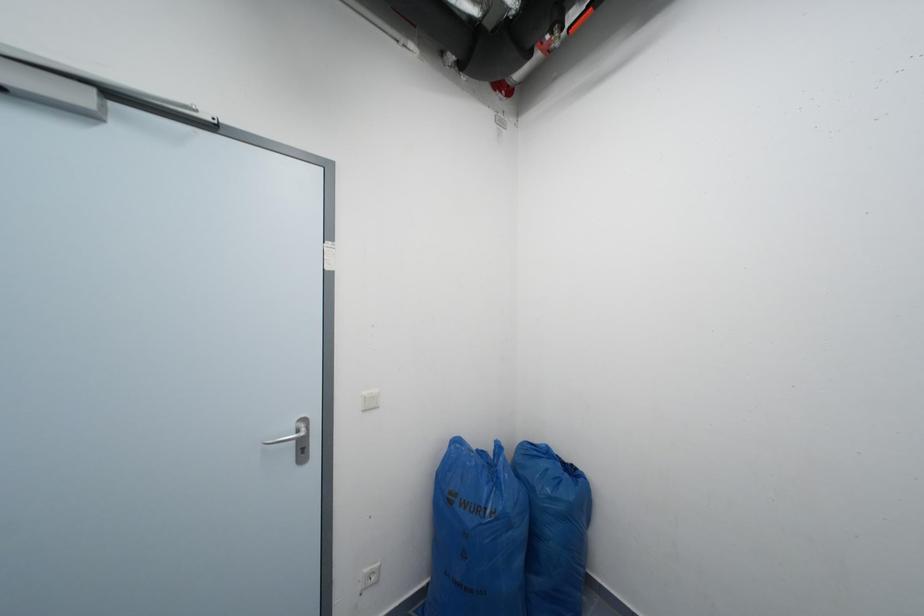
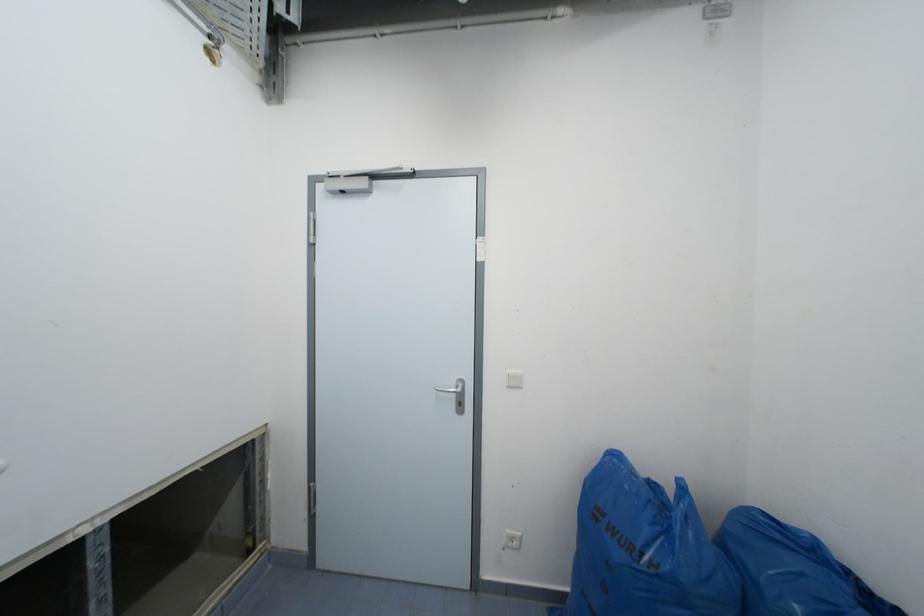
Question: The camera is either moving clockwise (left) or counter-clockwise (right) around the object. The first image is from the beginning of the video and the second image is from the end. Is the camera moving left or right when shooting the video?

Choices:
 (A) Left
 (B) Right

Answer: (B)